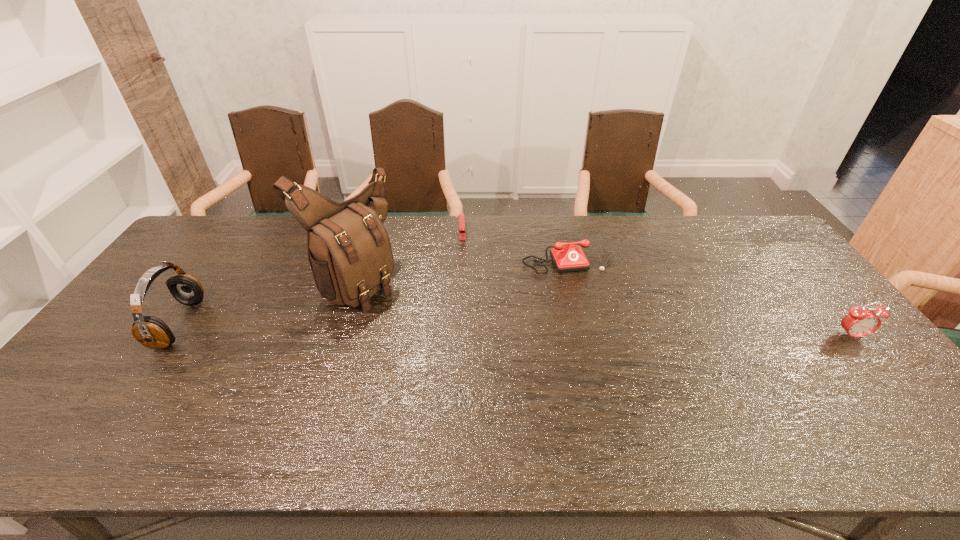
Identify the location of blank space that satisfies the following two spatial constraints: 1. on the front side of the third object from left to right; 2. on the left side of the second shortest object. (461, 254).